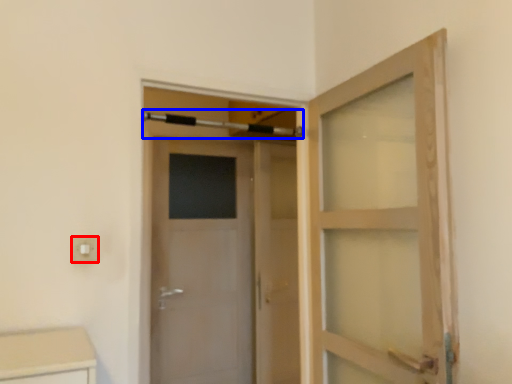
Question: Among these objects, which one is farthest to the camera, electric outlet (highlighted by a red box) or towel bar (highlighted by a blue box)?

Choices:
 (A) electric outlet
 (B) towel bar

Answer: (B)